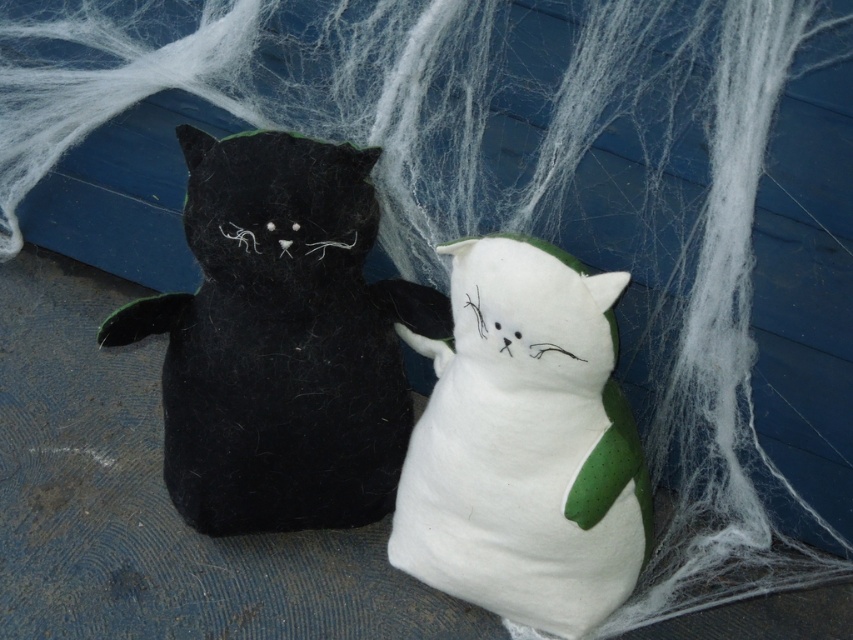
Question: Which object appears closest to the camera in this image?

Choices:
 (A) matte black plush cat at left
 (B) white felt cat at center

Answer: (B)

Question: Can you confirm if matte black plush cat at left is positioned below white felt cat at center?

Choices:
 (A) yes
 (B) no

Answer: (B)

Question: Can you confirm if matte black plush cat at left is thinner than white felt cat at center?

Choices:
 (A) no
 (B) yes

Answer: (A)

Question: Which point appears farthest from the camera in this image?

Choices:
 (A) coord(317,177)
 (B) coord(498,525)

Answer: (B)

Question: Is matte black plush cat at left further to camera compared to white felt cat at center?

Choices:
 (A) yes
 (B) no

Answer: (A)